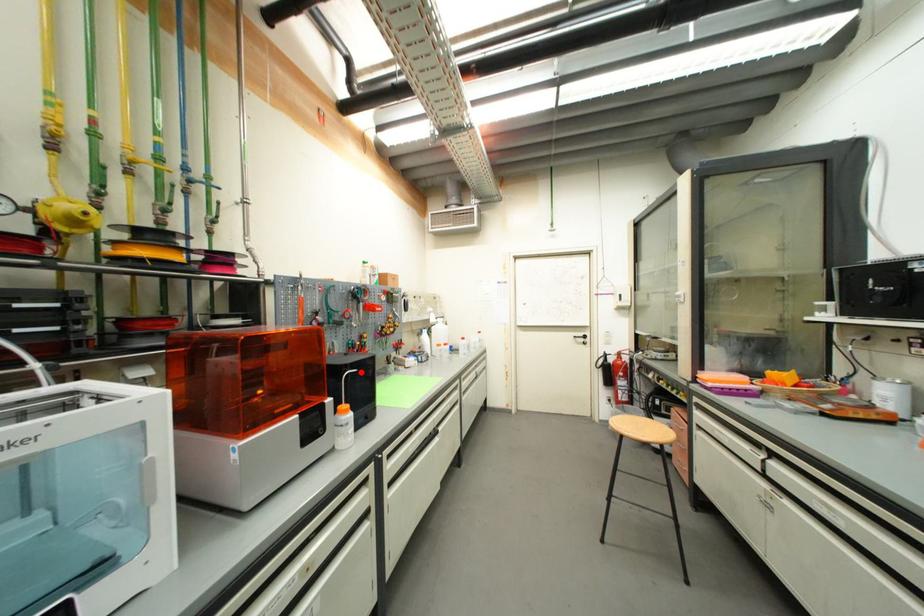
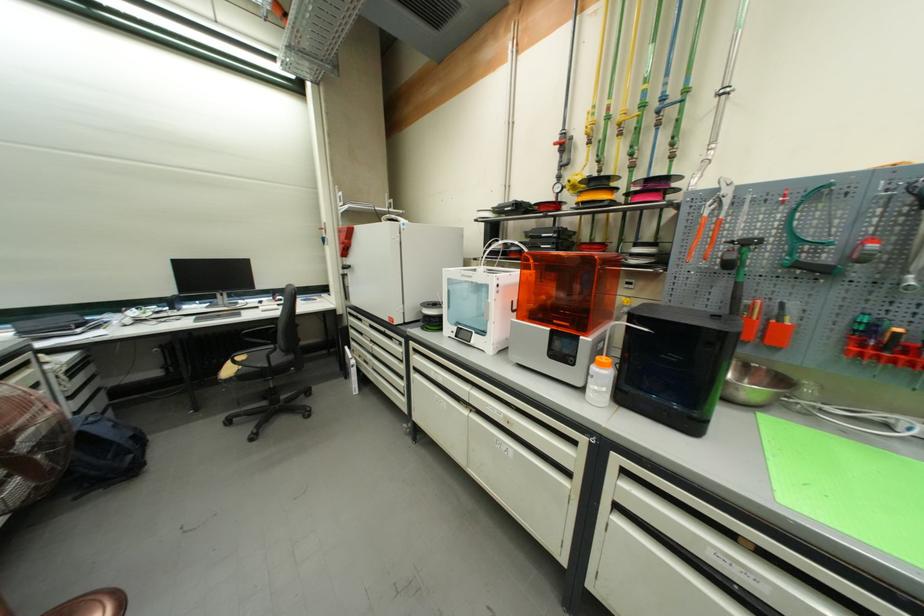
In the second image, find the point that corresponds to the highlighted location in the first image.

(651, 331)